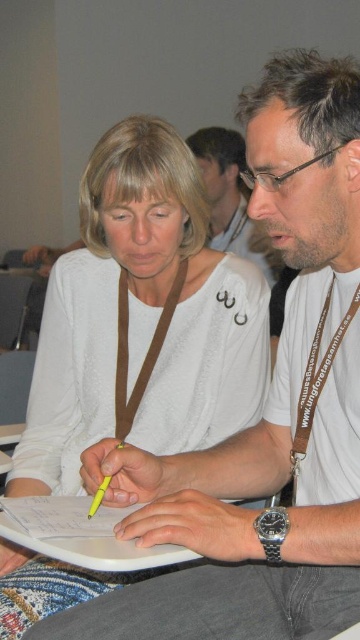
Does white matte shirt at upper left have a lesser width compared to matte white shirt at center?

In fact, white matte shirt at upper left might be wider than matte white shirt at center.

Find the location of a particular element. This screenshot has height=640, width=360. white matte shirt at upper left is located at coordinates (141, 320).

Identify the location of white matte shirt at upper left. The height and width of the screenshot is (640, 360). (141, 320).